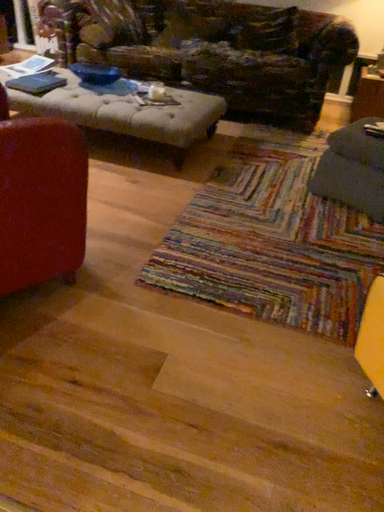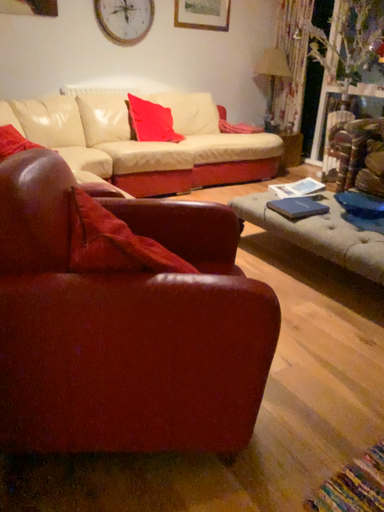
Question: Which way did the camera rotate in the video?

Choices:
 (A) rotated downward
 (B) rotated upward

Answer: (B)